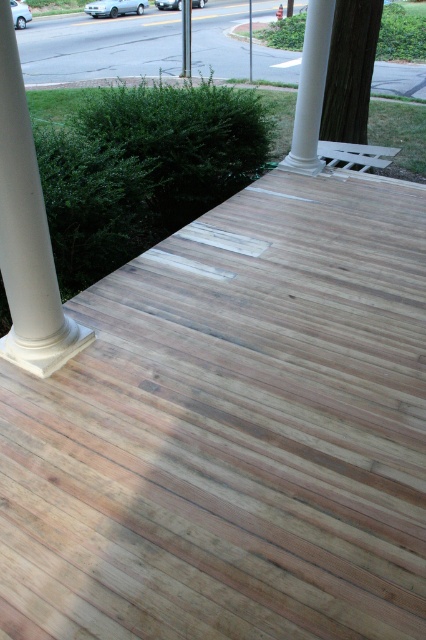
From the picture: Between white smooth column at left and white smooth column at upper center, which one appears on the left side from the viewer's perspective?

white smooth column at left

This screenshot has height=640, width=426. What are the coordinates of `white smooth column at left` in the screenshot? It's located at (28, 234).

Who is more forward, (11, 193) or (307, 156)?

Positioned in front is point (11, 193).

Find the location of a particular element. The width and height of the screenshot is (426, 640). white smooth column at left is located at coordinates (28, 234).